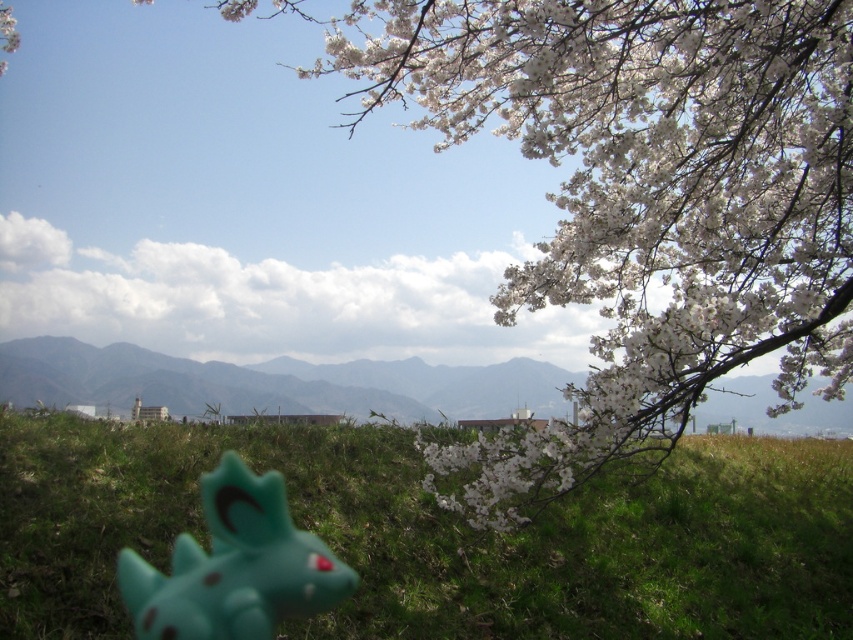
From the picture: Is green grassy at lower center behind green plastic toy at center?

No, it is not.

Who is lower down, green grassy at lower center or green plastic toy at center?

green grassy at lower center is lower down.

Does point (669, 522) come farther from viewer compared to point (273, 371)?

No, it is not.

Find the location of a particular element. green grassy at lower center is located at coordinates (440, 536).

Is the position of green plastic toy at center more distant than that of teal rubber toy at lower left?

Yes, it is.

From the picture: How far apart are green plastic toy at center and teal rubber toy at lower left?

The distance of green plastic toy at center from teal rubber toy at lower left is 7.54 meters.

The height and width of the screenshot is (640, 853). Find the location of `green plastic toy at center`. green plastic toy at center is located at coordinates (273, 381).

The width and height of the screenshot is (853, 640). What are the coordinates of `green plastic toy at center` in the screenshot? It's located at (273, 381).

Is green grassy at lower center thinner than teal rubber toy at lower left?

Indeed, green grassy at lower center has a lesser width compared to teal rubber toy at lower left.

Between green grassy at lower center and teal rubber toy at lower left, which one is positioned higher?

green grassy at lower center is higher up.

Locate an element on the screen. The image size is (853, 640). green grassy at lower center is located at coordinates (440, 536).

Identify the location of green grassy at lower center. The width and height of the screenshot is (853, 640). (440, 536).